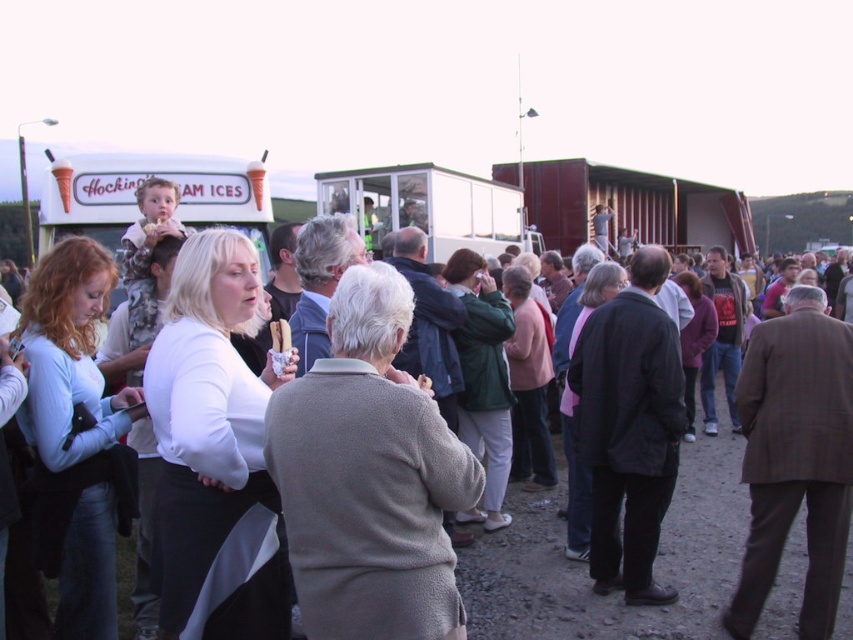
Between white cotton shirt at center and white plastic food truck at center, which one appears on the left side from the viewer's perspective?

white plastic food truck at center is more to the left.

This screenshot has height=640, width=853. What do you see at coordinates (585, 564) in the screenshot? I see `white cotton shirt at center` at bounding box center [585, 564].

Which is in front, point (672, 515) or point (370, 193)?

Point (672, 515)

The image size is (853, 640). Identify the location of white cotton shirt at center. (585, 564).

Can you confirm if white cotton shirt at center is bigger than white plastic ice cream truck at upper left?

Correct, white cotton shirt at center is larger in size than white plastic ice cream truck at upper left.

Can you confirm if white cotton shirt at center is smaller than white plastic ice cream truck at upper left?

Incorrect, white cotton shirt at center is not smaller in size than white plastic ice cream truck at upper left.

Where is `white cotton shirt at center`? The width and height of the screenshot is (853, 640). white cotton shirt at center is located at coordinates (585, 564).

Is point (74, 232) in front of point (366, 218)?

Yes, it is in front of point (366, 218).

Does white plastic ice cream truck at upper left appear over white plastic food truck at center?

No, white plastic ice cream truck at upper left is not above white plastic food truck at center.

Is point (189, 182) behind point (444, 202)?

No, (189, 182) is in front of (444, 202).

This screenshot has height=640, width=853. Find the location of `white plastic ice cream truck at upper left`. white plastic ice cream truck at upper left is located at coordinates (141, 182).